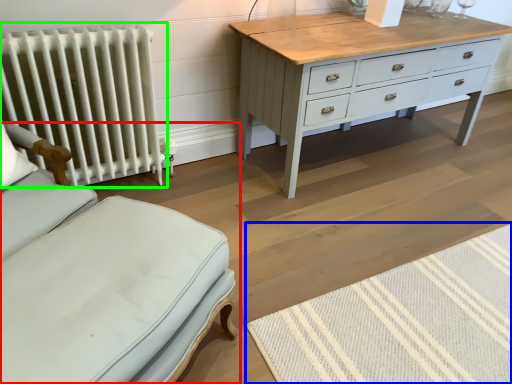
Question: Estimate the real-world distances between objects in this image. Which object is farther from furniture (highlighted by a red box), mat (highlighted by a blue box) or radiator (highlighted by a green box)?

Choices:
 (A) mat
 (B) radiator

Answer: (B)